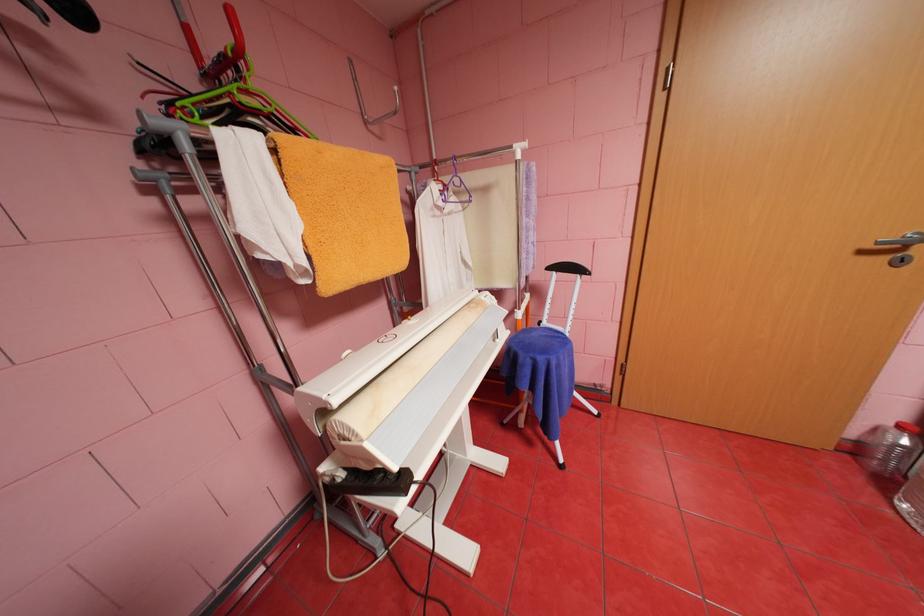
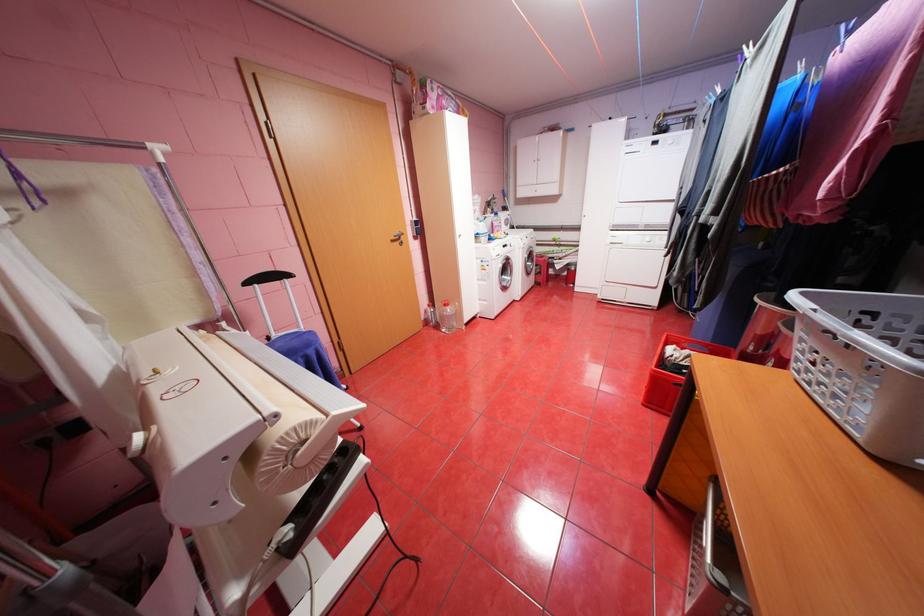
Find the pixel in the second image that matches the point at 870,252 in the first image.

(400, 241)